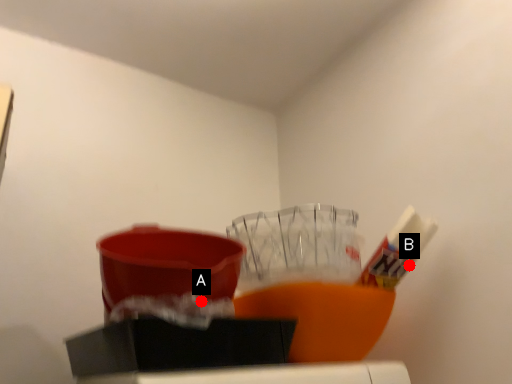
Question: Two points are circled on the image, labeled by A and B beside each circle. Which point appears closest to the camera in this image?

Choices:
 (A) A is closer
 (B) B is closer

Answer: (A)